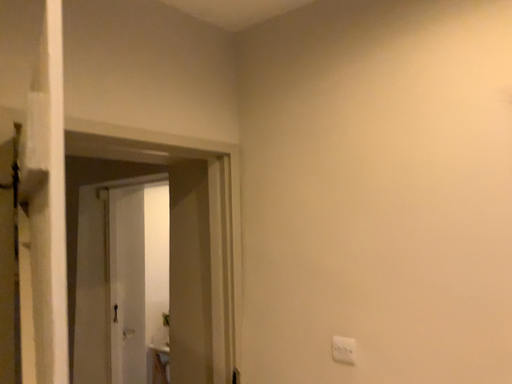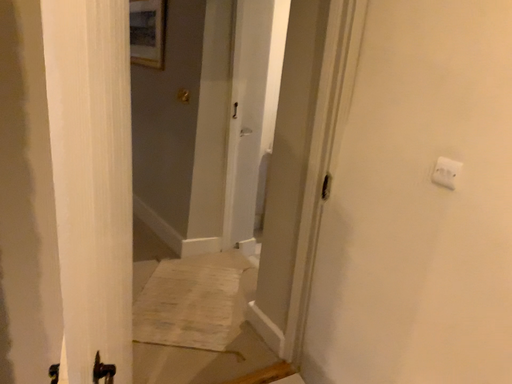
Question: Which way did the camera rotate in the video?

Choices:
 (A) rotated upward
 (B) rotated downward

Answer: (B)